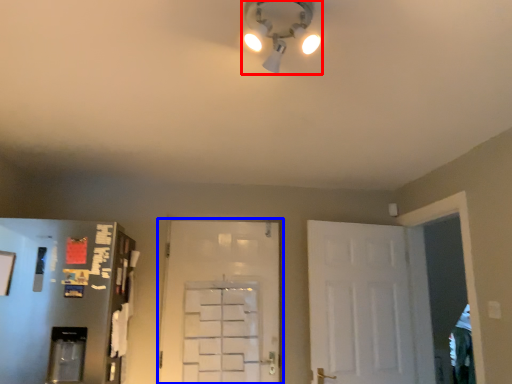
Question: Among these objects, which one is nearest to the camera, light fixture (highlighted by a red box) or door (highlighted by a blue box)?

Choices:
 (A) light fixture
 (B) door

Answer: (A)